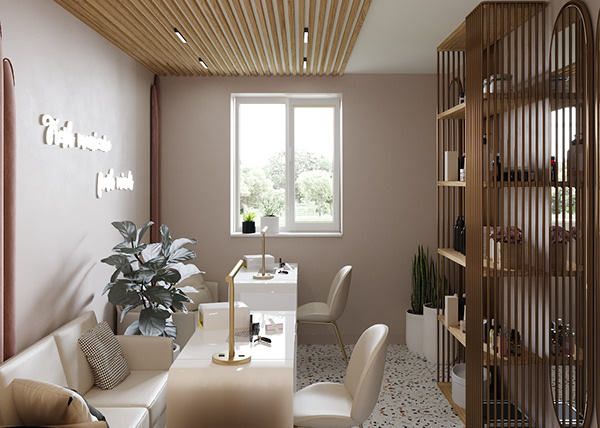
This screenshot has width=600, height=428. I want to click on speckled white tile floor, so click(x=403, y=395).